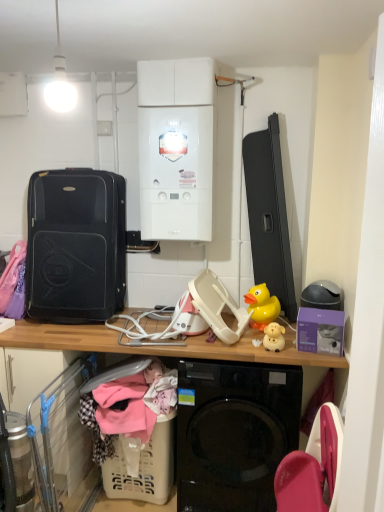
The height and width of the screenshot is (512, 384). Identify the location of free location to the left of matte yellow plastic toy at center, the second toy positioned from the back. (250, 346).